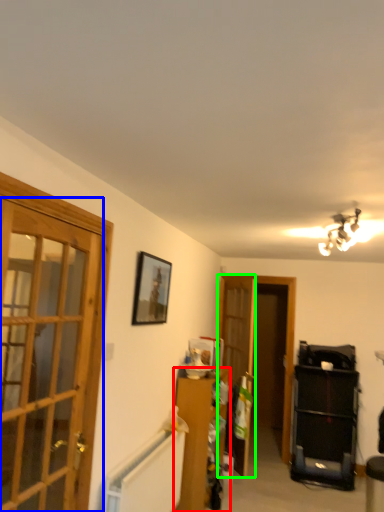
Question: Which object is the closest to the furniture (highlighted by a red box)? Choose among these: door (highlighted by a blue box) or screen door (highlighted by a green box).

Choices:
 (A) door
 (B) screen door

Answer: (B)